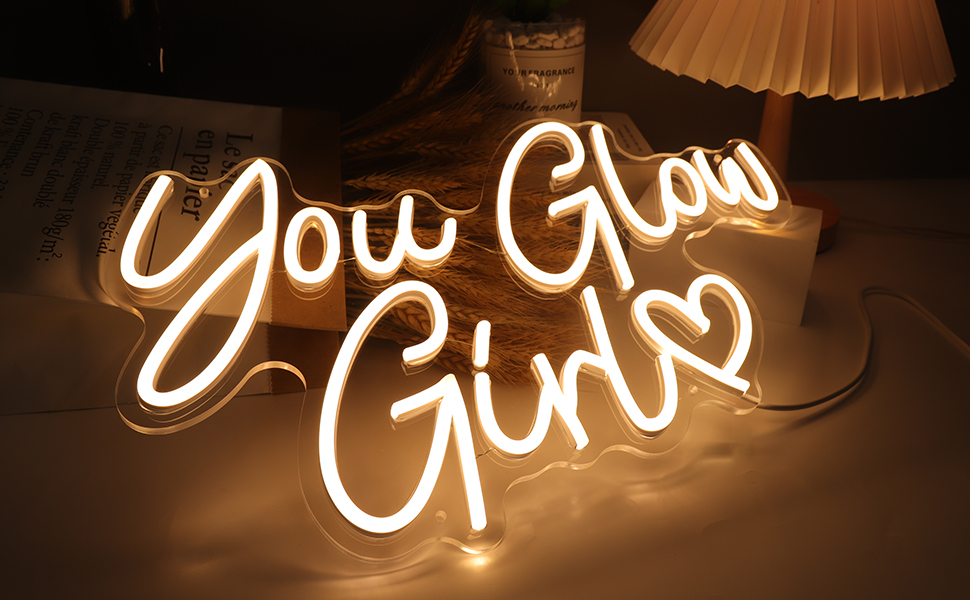
Where is `desk light cable cord`? Image resolution: width=970 pixels, height=600 pixels. desk light cable cord is located at coordinates (895, 223).